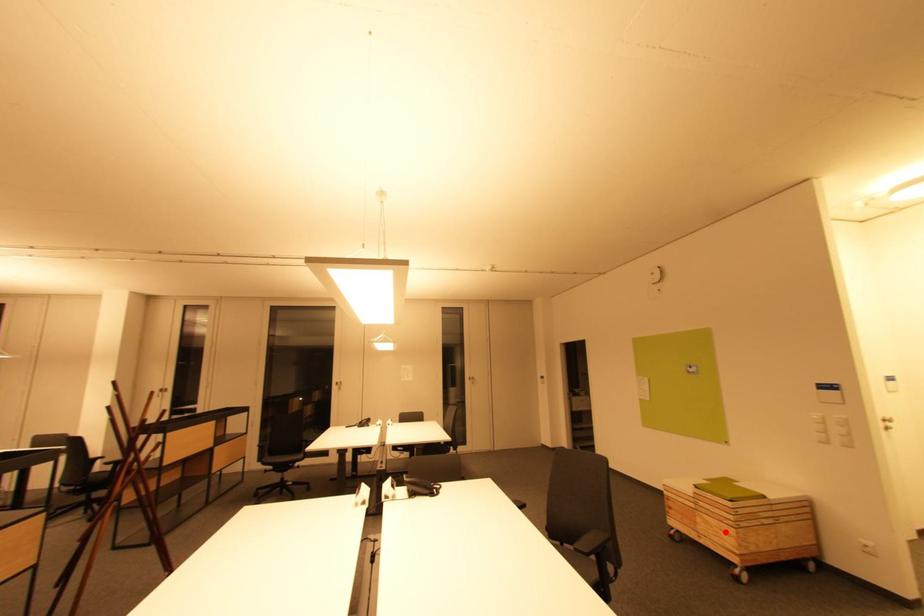
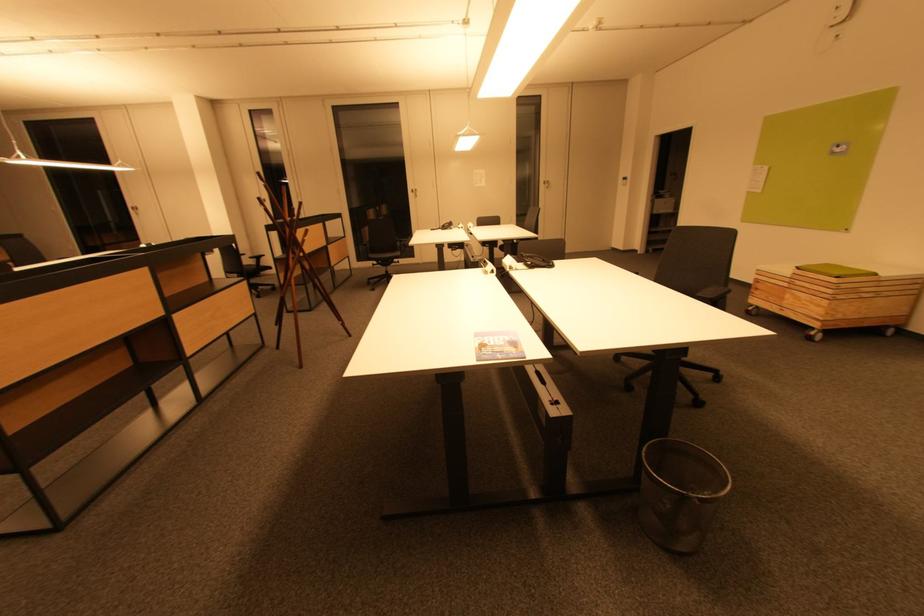
The point at the highlighted location is marked in the first image. Where is the corresponding point in the second image?

(816, 305)